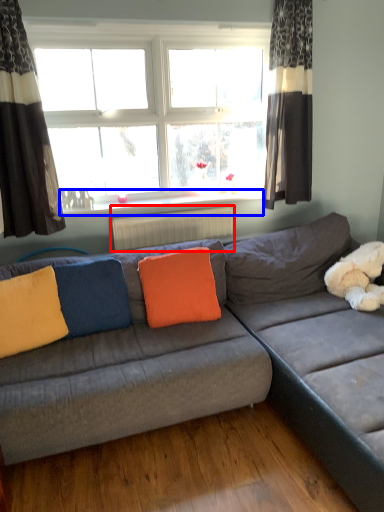
Question: Among these objects, which one is nearest to the camera, radiator (highlighted by a red box) or window sill (highlighted by a blue box)?

Choices:
 (A) radiator
 (B) window sill

Answer: (B)